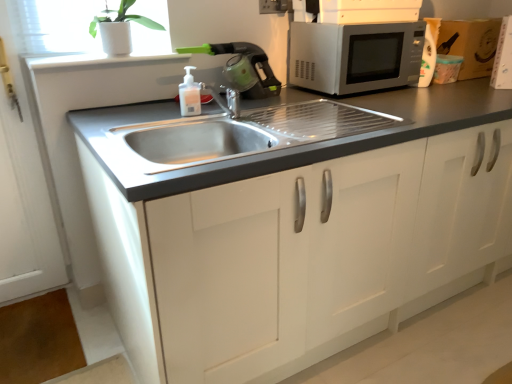
Question: Is the depth of brown cardboard box at upper right less than that of black plastic electric outlet at upper center?

Choices:
 (A) no
 (B) yes

Answer: (A)

Question: Is brown cardboard box at upper right surrounding black plastic electric outlet at upper center?

Choices:
 (A) no
 (B) yes

Answer: (A)

Question: Considering the relative sizes of brown cardboard box at upper right and black plastic electric outlet at upper center in the image provided, is brown cardboard box at upper right smaller than black plastic electric outlet at upper center?

Choices:
 (A) yes
 (B) no

Answer: (B)

Question: Is brown cardboard box at upper right aimed at black plastic electric outlet at upper center?

Choices:
 (A) no
 (B) yes

Answer: (A)

Question: Can you confirm if brown cardboard box at upper right is wider than black plastic electric outlet at upper center?

Choices:
 (A) yes
 (B) no

Answer: (A)

Question: From the image's perspective, is brown cardboard box at upper right under black plastic electric outlet at upper center?

Choices:
 (A) yes
 (B) no

Answer: (A)

Question: Can you confirm if satin silver microwave at upper right is smaller than brown cardboard box at upper right?

Choices:
 (A) yes
 (B) no

Answer: (B)

Question: Is satin silver microwave at upper right taller than brown cardboard box at upper right?

Choices:
 (A) yes
 (B) no

Answer: (B)

Question: Can you confirm if satin silver microwave at upper right is positioned to the right of brown cardboard box at upper right?

Choices:
 (A) yes
 (B) no

Answer: (B)

Question: Is satin silver microwave at upper right not within brown cardboard box at upper right?

Choices:
 (A) yes
 (B) no

Answer: (A)

Question: Is satin silver microwave at upper right next to brown cardboard box at upper right and touching it?

Choices:
 (A) yes
 (B) no

Answer: (B)

Question: From a real-world perspective, is satin silver microwave at upper right on brown cardboard box at upper right?

Choices:
 (A) no
 (B) yes

Answer: (B)

Question: From a real-world perspective, is white ceramic pot at upper left under brown cardboard box at upper right?

Choices:
 (A) no
 (B) yes

Answer: (A)